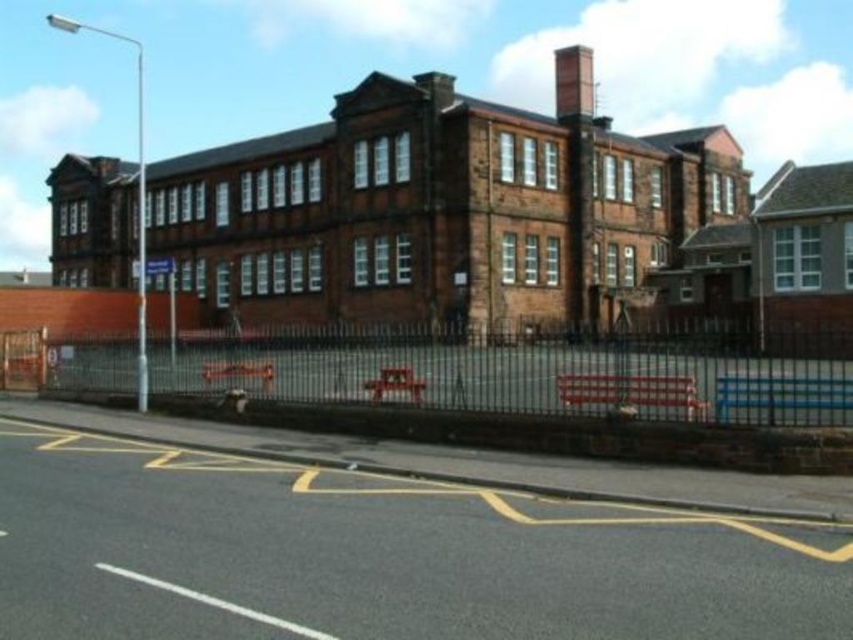
Is black metal fence at lower center positioned in front of smooth brick chimney at upper center?

Yes.

Can you confirm if black metal fence at lower center is positioned above smooth brick chimney at upper center?

Incorrect, black metal fence at lower center is not positioned above smooth brick chimney at upper center.

You are a GUI agent. You are given a task and a screenshot of the screen. Output one action in this format:
    pyautogui.click(x=<x>, y=<y>)
    Task: Click on the black metal fence at lower center
    This screenshot has height=640, width=853.
    Given the screenshot: What is the action you would take?
    pyautogui.click(x=531, y=371)